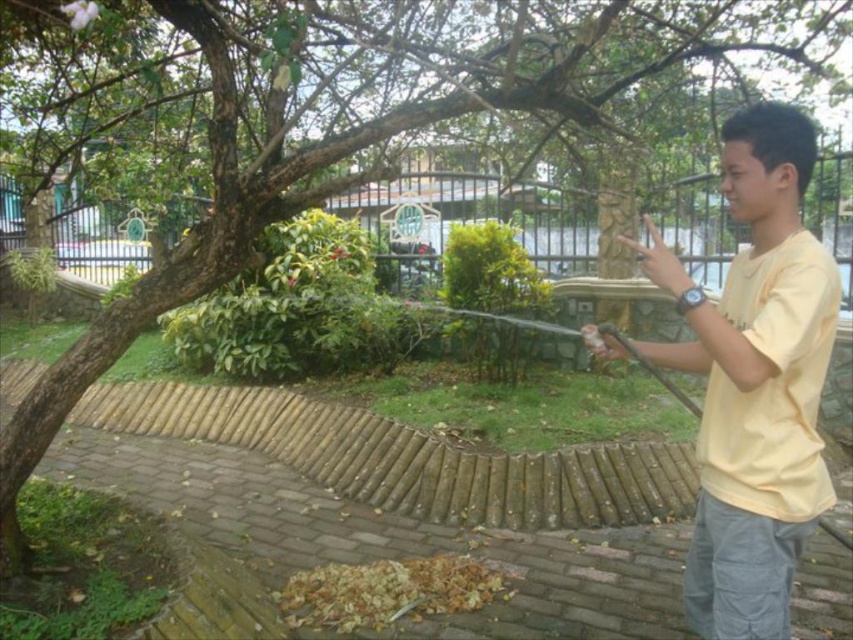
You are a fashion designer observing the outdoor scene. You need to determine if the yellow cotton shirt at right can be displayed on a mannequin placed next to the black metal fence at upper center. Considering their widths, will the shirt fit on the mannequin without overlapping the fence?

The yellow cotton shirt at right has a larger width than the black metal fence at upper center. Since the shirt is wider, it may require more space and could potentially overlap the fence if placed too close. To avoid overlapping, the mannequin should be positioned further away from the fence or the fence should be moved to accommodate the shirt.

You are standing at the point with coordinates (x=753, y=380) in the image. What object is located at this point?

The yellow cotton shirt at right is located at point (x=753, y=380).

You are a photographer positioned in the garden and want to capture a clear photo of the yellow cotton shirt at right and the black metal fence at upper center. Which object will appear larger in the photo?

The yellow cotton shirt at right will appear larger in the photo because it is closer to the viewer than the black metal fence at upper center.